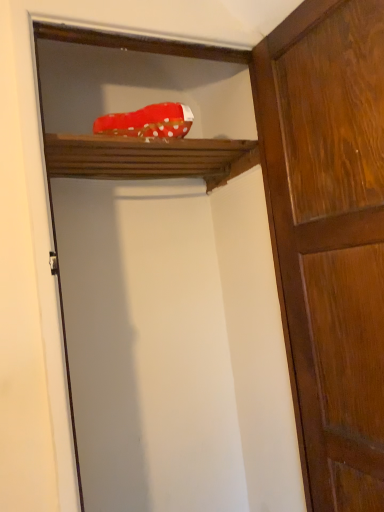
Question: Based on their positions, is wooden shelf at upper center located to the left or right of shiny brown wood door at right?

Choices:
 (A) left
 (B) right

Answer: (A)

Question: Looking at their shapes, would you say wooden shelf at upper center is wider or thinner than shiny brown wood door at right?

Choices:
 (A) wide
 (B) thin

Answer: (A)

Question: Which object is the closest to the wooden shelf at upper center?

Choices:
 (A) shiny brown wood door at right
 (B) red polka dot fabric at upper center

Answer: (B)

Question: Which is nearer to the shiny brown wood door at right?

Choices:
 (A) wooden shelf at upper center
 (B) red polka dot fabric at upper center

Answer: (A)